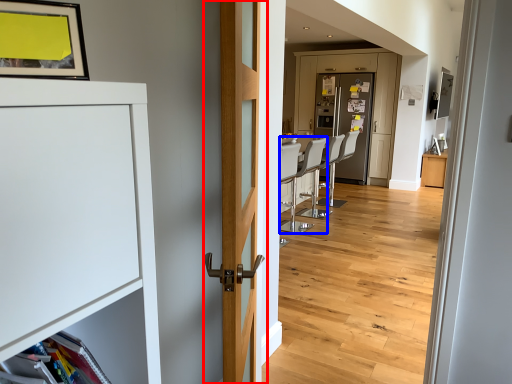
Question: Which point is closer to the camera, door (highlighted by a red box) or armchair (highlighted by a blue box)?

Choices:
 (A) door
 (B) armchair

Answer: (A)